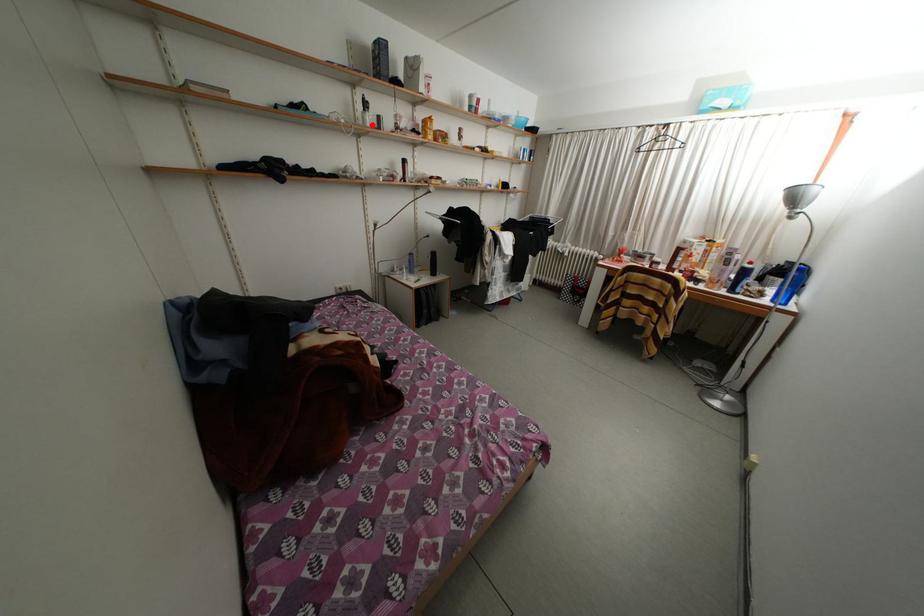
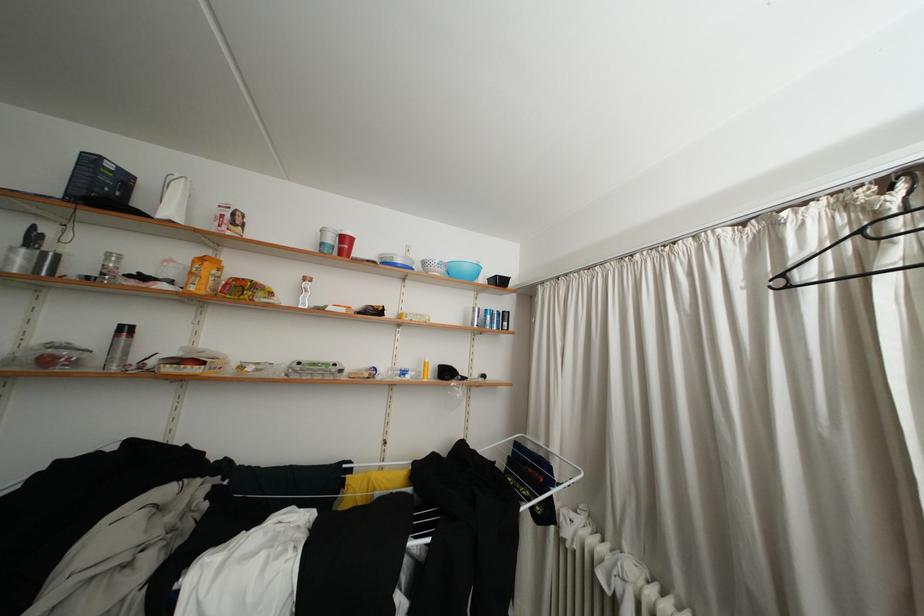
Question: I am providing you with two images of the same scene from different viewpoints. A red point is shown in image1. For the corresponding object point in image2, is it positioned nearer or farther from the camera?

Choices:
 (A) Nearer
 (B) Farther

Answer: (B)